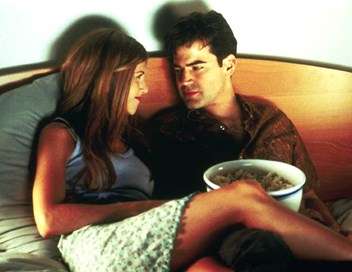
Identify the location of bowl. (289, 199).